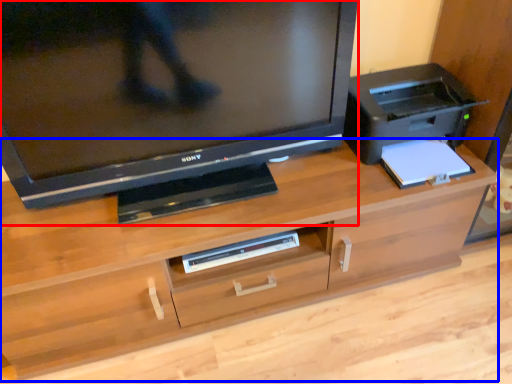
Question: Which of the following is the farthest to the observer, television (highlighted by a red box) or desk (highlighted by a blue box)?

Choices:
 (A) television
 (B) desk

Answer: (B)